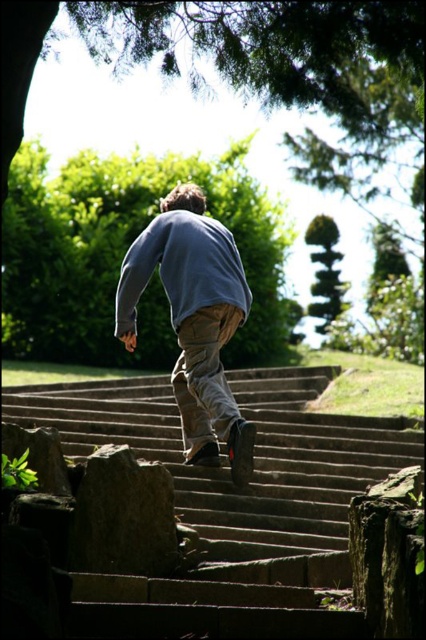
Question: Which of these objects is positioned closest to the stone stairs at center?

Choices:
 (A) gray rough stone at lower left
 (B) light blue cotton shirt at center

Answer: (A)

Question: Which point is farther to the camera?

Choices:
 (A) light blue cotton shirt at center
 (B) gray rough stone at lower left
 (C) stone stairs at center

Answer: (A)

Question: Which of these objects is positioned closest to the gray rough stone at lower left?

Choices:
 (A) stone stairs at center
 (B) light blue cotton shirt at center

Answer: (A)

Question: Can you confirm if light blue cotton shirt at center is thinner than gray rough stone at lower left?

Choices:
 (A) no
 (B) yes

Answer: (B)

Question: Where is stone stairs at center located in relation to light blue cotton shirt at center in the image?

Choices:
 (A) below
 (B) above

Answer: (B)

Question: Can you confirm if light blue cotton shirt at center is positioned below gray rough stone at lower left?

Choices:
 (A) yes
 (B) no

Answer: (B)